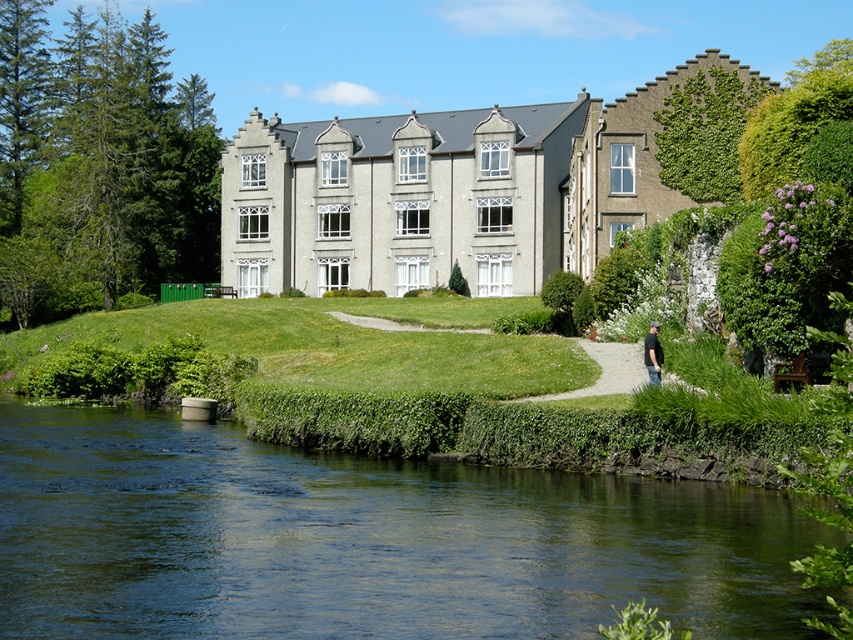
You are standing on the lawn in front of the building and notice the green smooth water at lower center and the black cotton shirt at lower right. Which object is located lower in the image?

The green smooth water at lower center is positioned under the black cotton shirt at lower right, so the green smooth water at lower center is lower in the image.

You are a delivery person carrying a package and need to cross the green smooth water at lower center to reach the black cotton shirt at lower right. Can you safely cross the water without getting your package wet?

The green smooth water at lower center might be wider than the black cotton shirt at lower right, so it is uncertain if you can cross safely without getting the package wet.

You are standing on the lawn in front of the building and want to walk to the black cotton shirt at lower right. Which direction should you move relative to the green smooth water at lower center?

You should move away from the green smooth water at lower center because the black cotton shirt at lower right is further from the viewer than the green smooth water at lower center.